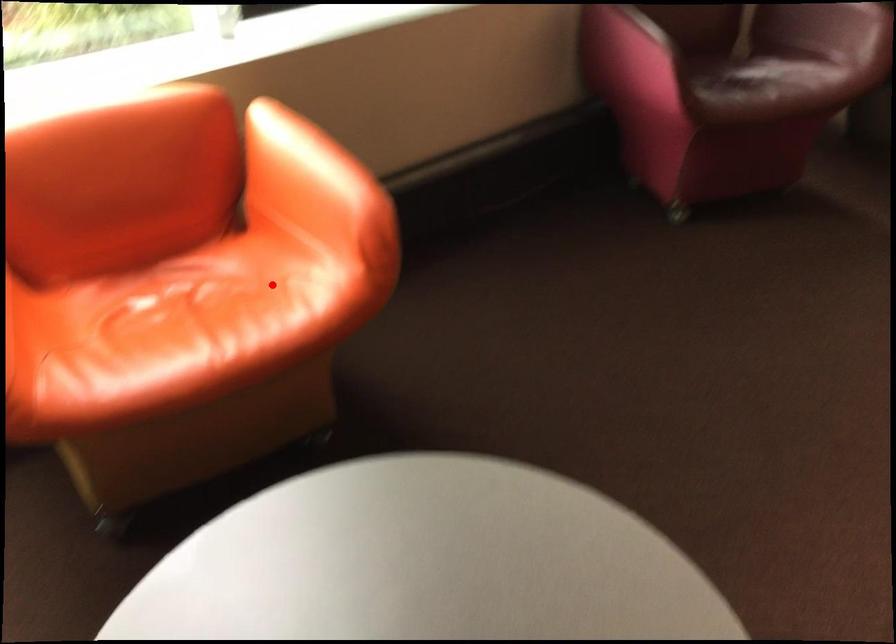
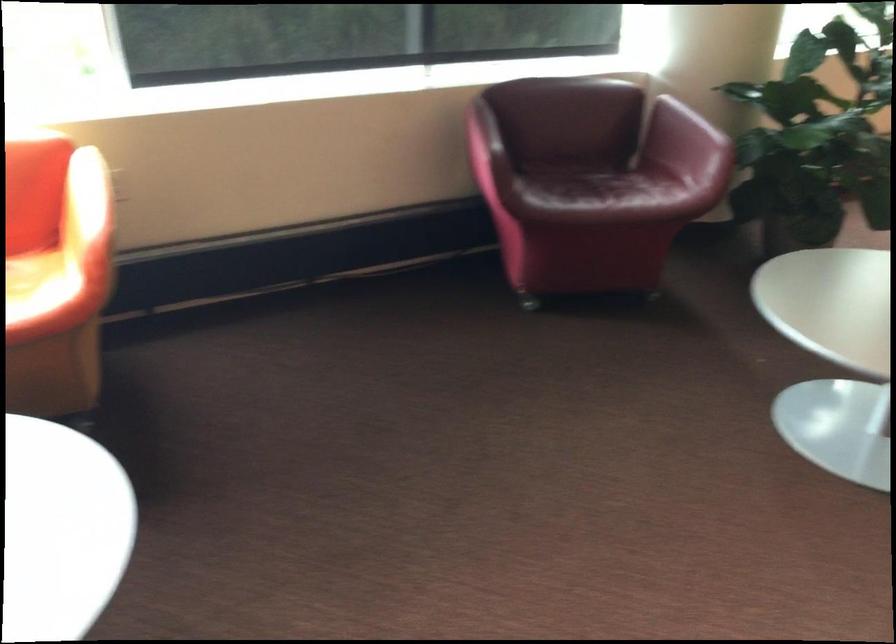
Question: I am providing you with two images of the same scene from different viewpoints. A red point is marked on the first image. At the location where the point appears in image 1, is it still visible in image 2?

Choices:
 (A) Yes
 (B) No

Answer: (A)